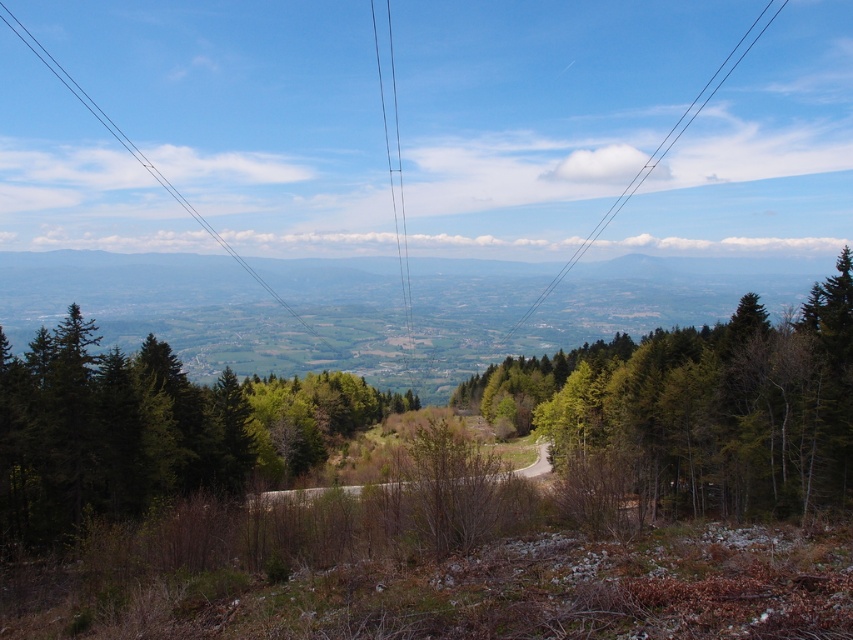
Looking at this image, you are a hiker trying to navigate through the forest. You see the green leafy tree at center and the clear wire at upper center. Which object is closer to you?

The green leafy tree at center is closer to you because it is in front of the clear wire at upper center.

You are a hiker standing at the edge of the forest and see the green leafy tree at center and the black wire at center. Which object is closer to the ground?

The green leafy tree at center is located below the black wire at center, so it is closer to the ground than the black wire at center.

You are a hiker standing on the winding road in the scene. You notice a green leafy tree at center and a black wire at center. Which object is closer to you?

The green leafy tree at center is closer to you because it is in front of the black wire at center.